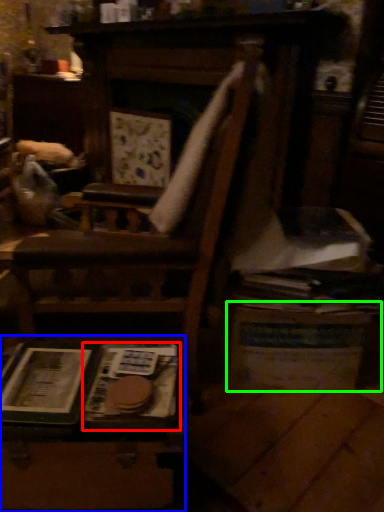
Question: Based on their relative distances, which object is nearer to paperback book (highlighted by a red box)? Choose from table (highlighted by a blue box) and table (highlighted by a green box).

Choices:
 (A) table
 (B) table

Answer: (A)